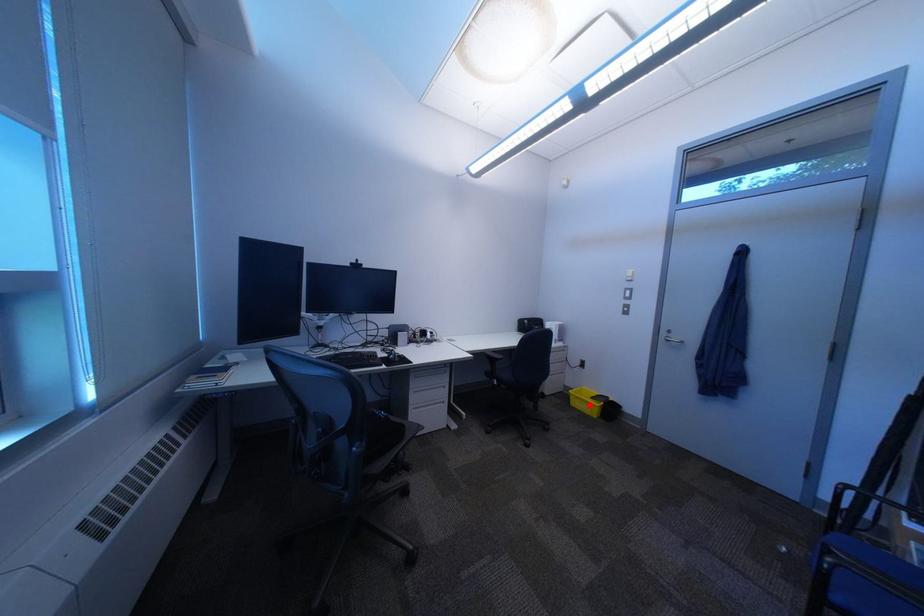
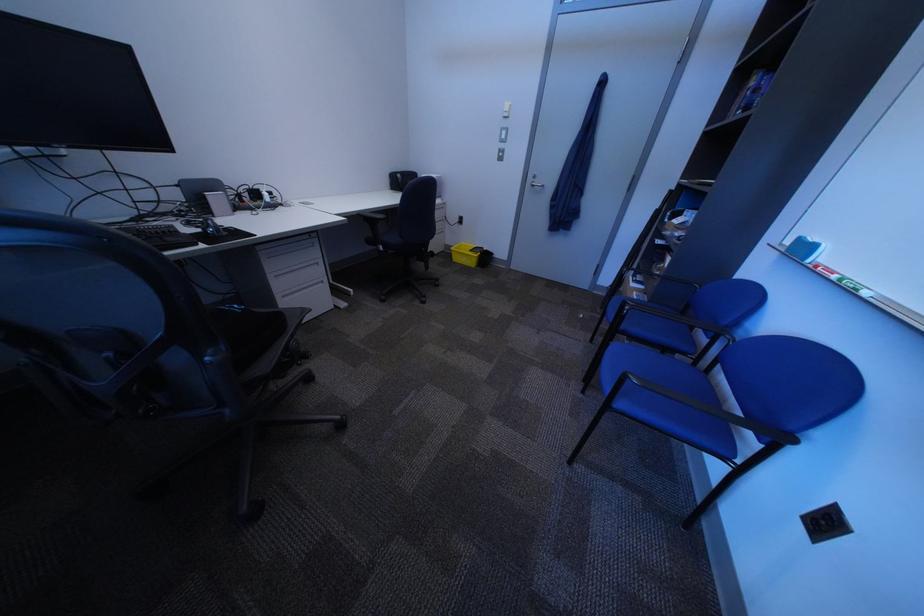
The point at the highlighted location is marked in the first image. Where is the corresponding point in the second image?

(470, 261)